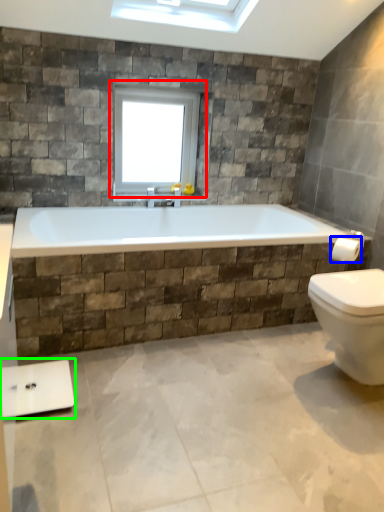
Question: Which object is the closest to the window (highlighted by a red box)? Choose among these: towel bar (highlighted by a blue box) or scale (highlighted by a green box).

Choices:
 (A) towel bar
 (B) scale

Answer: (A)